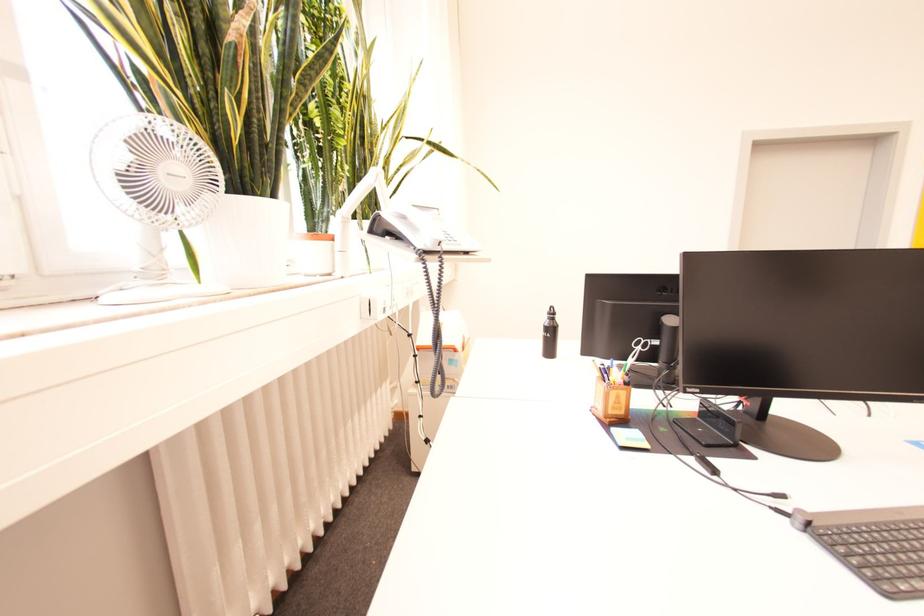
Where is `terracotta flower pot`? terracotta flower pot is located at coordinates (245, 241).